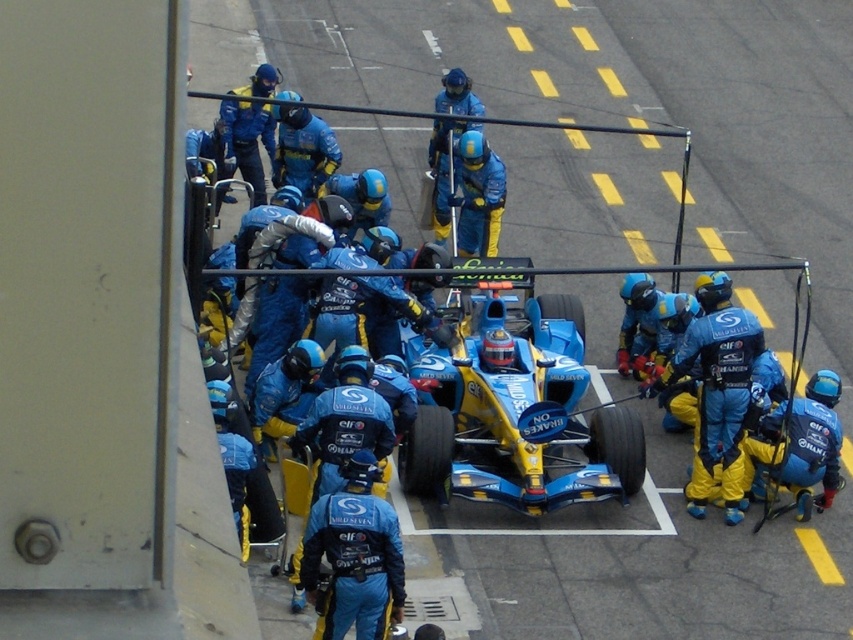
Does blue glossy race car at center come in front of blue fabric suit at center?

That is False.

Does blue glossy race car at center have a smaller size compared to blue fabric suit at center?

Incorrect, blue glossy race car at center is not smaller in size than blue fabric suit at center.

The width and height of the screenshot is (853, 640). I want to click on blue glossy race car at center, so click(512, 404).

Is blue glossy race car at center taller than blue/textured jumpsuit at lower right?

Yes, blue glossy race car at center is taller than blue/textured jumpsuit at lower right.

Identify the location of blue glossy race car at center. (512, 404).

Can you confirm if blue fabric suit at center is positioned below blue/textured jumpsuit at lower right?

Yes.

Is blue fabric suit at center to the right of blue/textured jumpsuit at lower right from the viewer's perspective?

Incorrect, blue fabric suit at center is not on the right side of blue/textured jumpsuit at lower right.

You are a GUI agent. You are given a task and a screenshot of the screen. Output one action in this format:
    pyautogui.click(x=<x>, y=<y>)
    Task: Click on the blue fabric suit at center
    This screenshot has height=640, width=853.
    Given the screenshot: What is the action you would take?
    pyautogui.click(x=354, y=556)